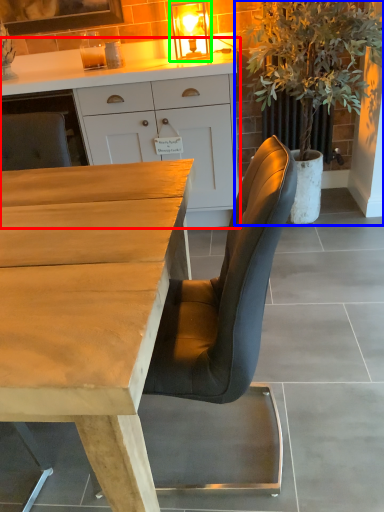
Question: Which object is positioned closest to cabinetry (highlighted by a red box)? Select from houseplant (highlighted by a blue box) and light fixture (highlighted by a green box).

Choices:
 (A) houseplant
 (B) light fixture

Answer: (B)